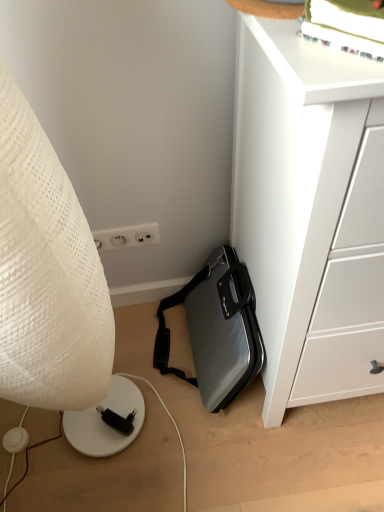
Identify the location of free space in front of silver textured briefcase at lower center. (237, 474).